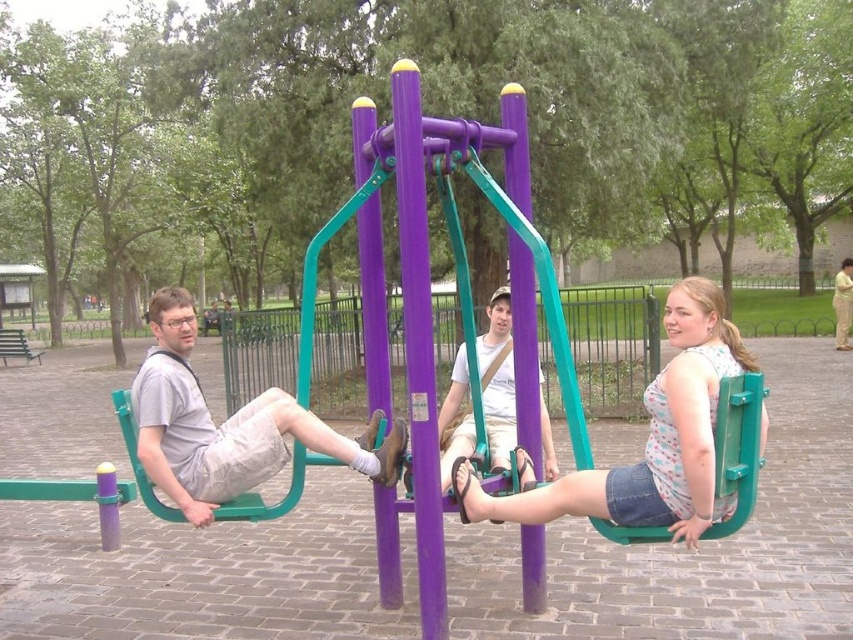
Question: Is denim shorts at center thinner than matte gray shorts at left?

Choices:
 (A) no
 (B) yes

Answer: (B)

Question: Is denim shorts at center to the right of matte gray shorts at left from the viewer's perspective?

Choices:
 (A) no
 (B) yes

Answer: (B)

Question: Which point is closer to the camera?

Choices:
 (A) (575, 472)
 (B) (347, 456)

Answer: (B)

Question: From the image, what is the correct spatial relationship of denim shorts at center in relation to matte gray shorts at left?

Choices:
 (A) left
 (B) right

Answer: (B)

Question: Which point is closer to the camera?

Choices:
 (A) matte gray shorts at left
 (B) denim shorts at center

Answer: (B)